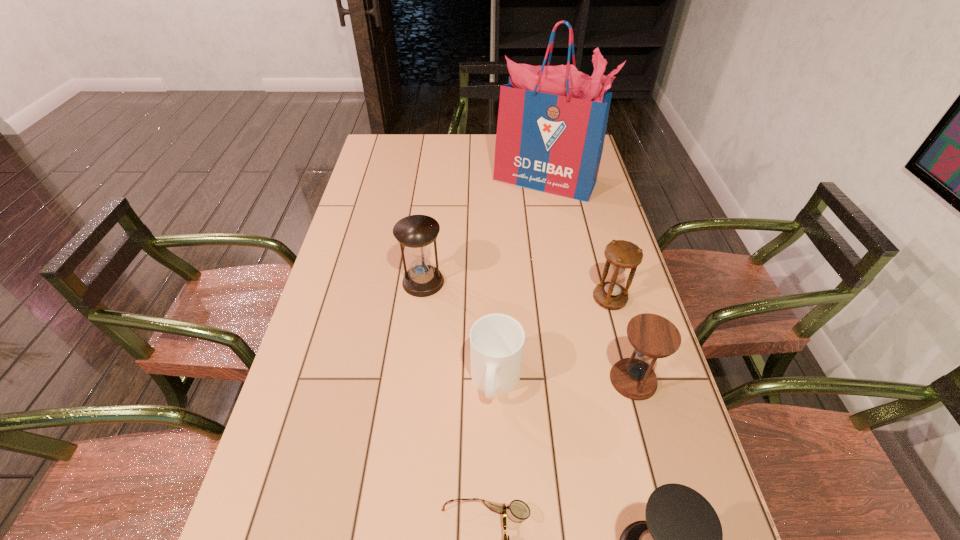
You are a GUI agent. You are given a task and a screenshot of the screen. Output one action in this format:
    pyautogui.click(x=<x>, y=<y>)
    Task: Click on the grocery bag situated at the right edge
    Image resolution: width=960 pixels, height=540 pixels.
    Given the screenshot: What is the action you would take?
    pyautogui.click(x=552, y=120)

The height and width of the screenshot is (540, 960). What are the coordinates of `object that is at the far right corner` in the screenshot? It's located at (552, 120).

In the image, there is a desktop. Where is `vacant space at the far edge`? The image size is (960, 540). vacant space at the far edge is located at coordinates (427, 136).

In the image, there is a desktop. Identify the location of vacant space at the left edge. (381, 195).

Where is `free space at the far left corner of the desktop`? Image resolution: width=960 pixels, height=540 pixels. free space at the far left corner of the desktop is located at coordinates (392, 156).

The image size is (960, 540). Identify the location of vacant point located between the third farthest hourglass and the farthest object. (589, 280).

The width and height of the screenshot is (960, 540). In order to click on vacant area that lies between the second nearest hourglass and the sixth tallest object in this screenshot , I will do `click(564, 380)`.

You are a GUI agent. You are given a task and a screenshot of the screen. Output one action in this format:
    pyautogui.click(x=<x>, y=<y>)
    Task: Click on the vacant point located between the farthest object and the third farthest hourglass
    This screenshot has width=960, height=540.
    Given the screenshot: What is the action you would take?
    pyautogui.click(x=589, y=280)

Locate which object ranks fifth in proximity to the second nearest hourglass. Please provide its 2D coordinates. Your answer should be formatted as a tuple, i.e. [(x, y)], where the tuple contains the x and y coordinates of a point satisfying the conditions above.

[(416, 232)]

The height and width of the screenshot is (540, 960). What are the coordinates of `object that ranks as the sixth closest to the shortest object` in the screenshot? It's located at (552, 120).